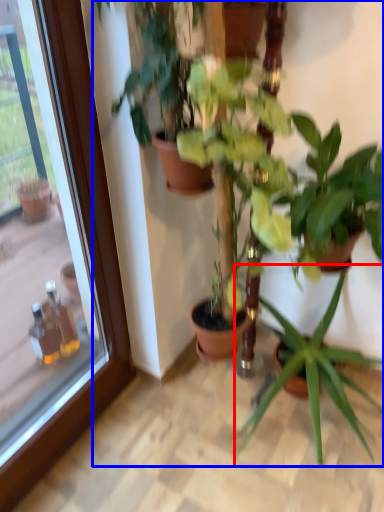
Question: Which object appears closest to the camera in this image, houseplant (highlighted by a red box) or houseplant (highlighted by a blue box)?

Choices:
 (A) houseplant
 (B) houseplant

Answer: (B)